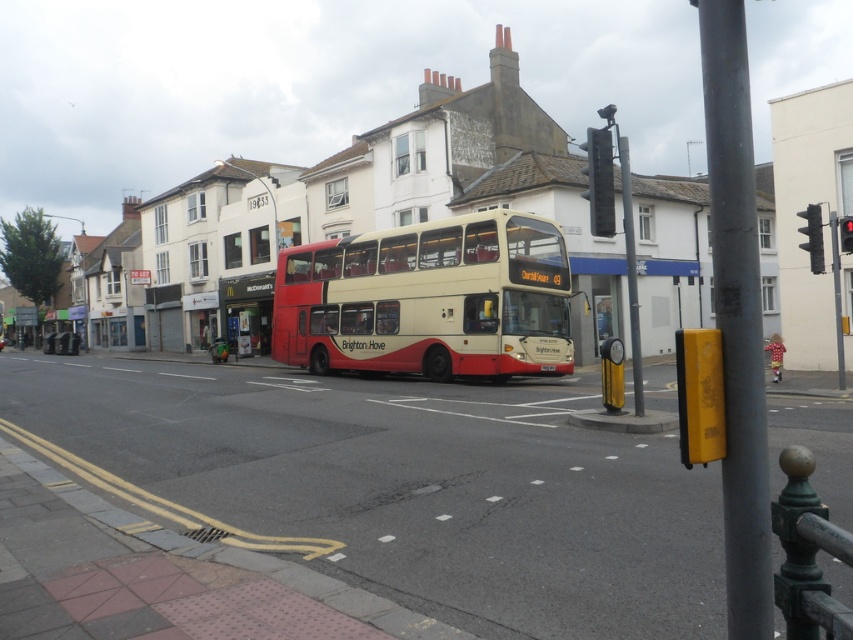
How distant is matte cream double-decker bus at center from white plastic license plate at center?

matte cream double-decker bus at center and white plastic license plate at center are 4.75 meters apart.

In the scene shown: Between matte cream double-decker bus at center and white plastic license plate at center, which one has less height?

Standing shorter between the two is white plastic license plate at center.

Between point (512, 250) and point (544, 364), which one is positioned behind?

The point (544, 364) is more distant.

The width and height of the screenshot is (853, 640). Identify the location of matte cream double-decker bus at center. tap(428, 300).

Looking at this image, between matte cream double-decker bus at center and black plastic traffic light at upper center, which one has more height?

black plastic traffic light at upper center

Who is higher up, matte cream double-decker bus at center or black plastic traffic light at upper center?

black plastic traffic light at upper center is above.

Where is `matte cream double-decker bus at center`? This screenshot has width=853, height=640. matte cream double-decker bus at center is located at coordinates (428, 300).

Who is more distant from viewer, (247,304) or (848,224)?

The point (247,304) is more distant.

Locate an element on the screen. black plastic mcdonald's sign at center is located at coordinates (247, 310).

Locate an element on the screen. The width and height of the screenshot is (853, 640). black plastic mcdonald's sign at center is located at coordinates (247, 310).

Where is `black plastic mcdonald's sign at center`? The height and width of the screenshot is (640, 853). black plastic mcdonald's sign at center is located at coordinates (247, 310).